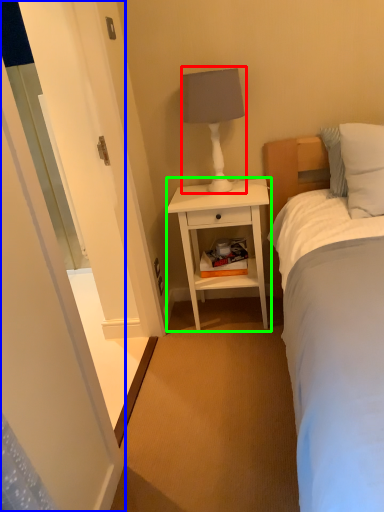
Question: Based on their relative distances, which object is nearer to table lamp (highlighted by a red box)? Choose from screen door (highlighted by a blue box) and nightstand (highlighted by a green box).

Choices:
 (A) screen door
 (B) nightstand

Answer: (B)